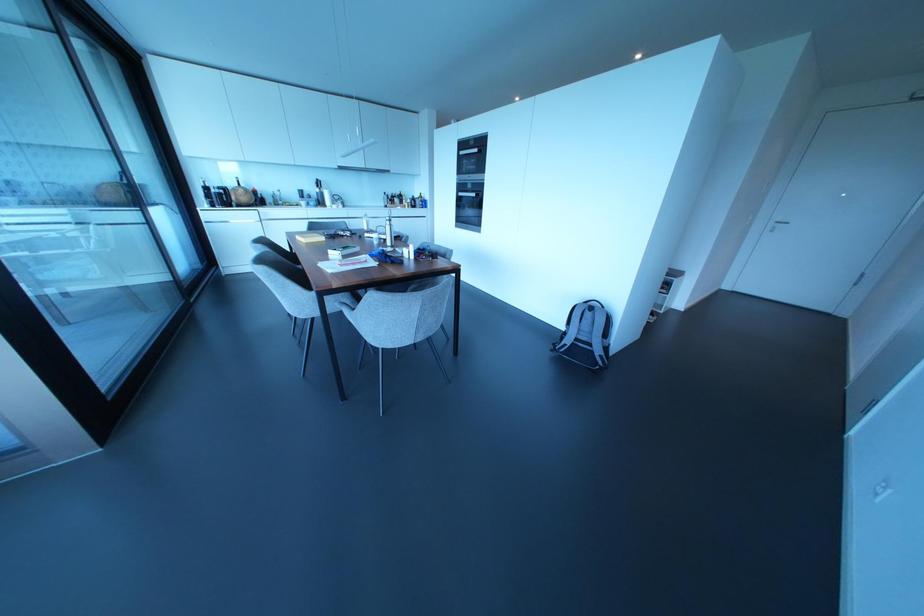
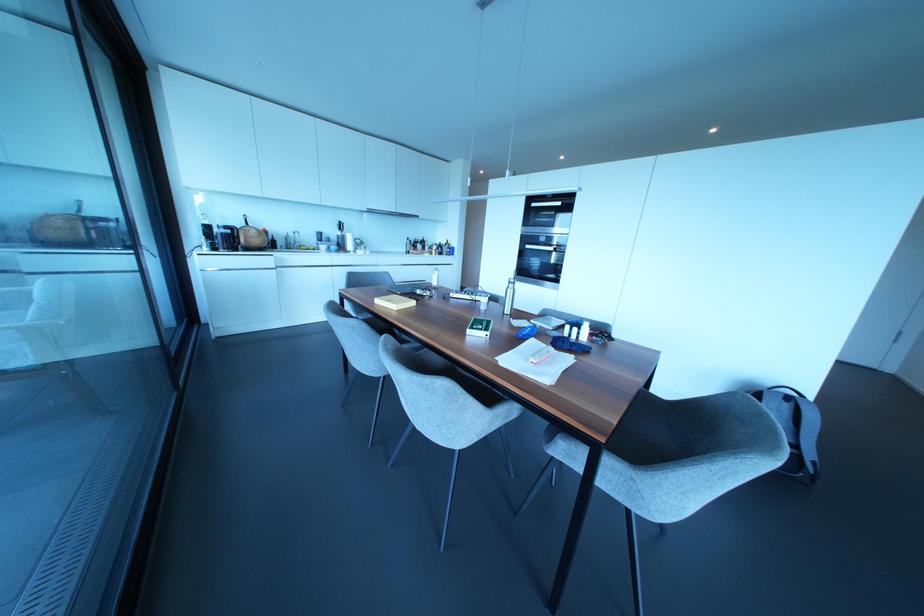
Where in the second image is the point corresponding to pixel 410 256 from the first image?

(584, 338)